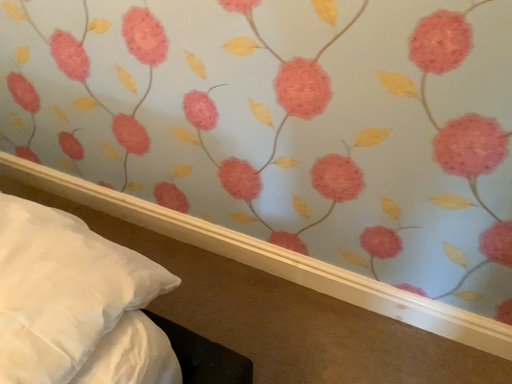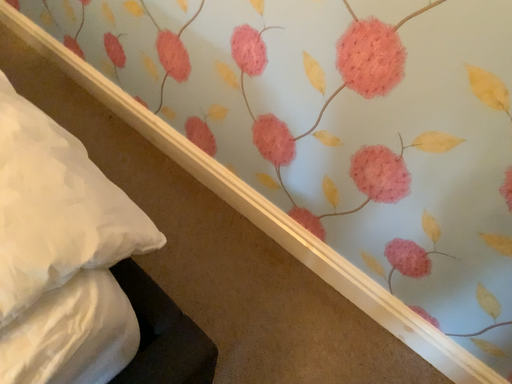
Question: Which way did the camera rotate in the video?

Choices:
 (A) rotated right
 (B) rotated left

Answer: (B)